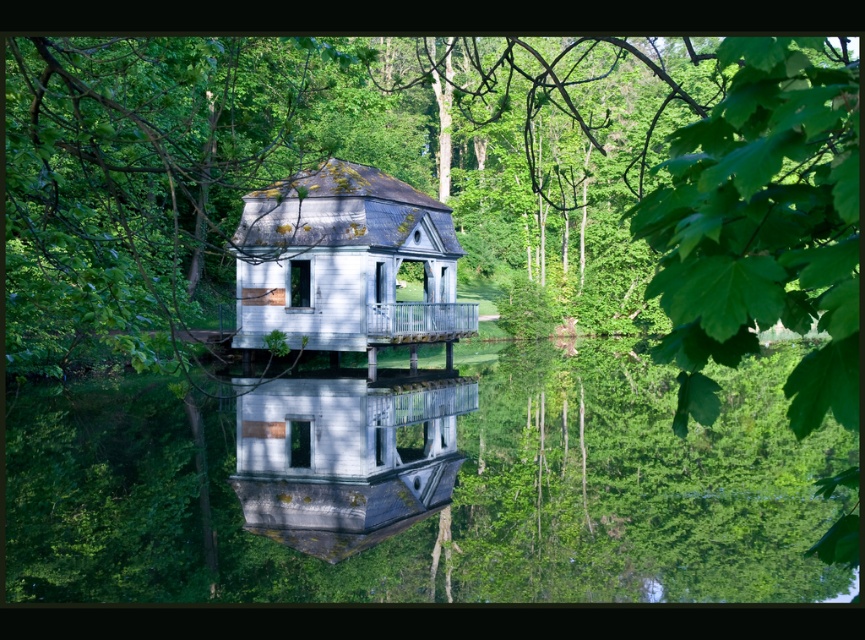
You are a photographer planning to capture the white matte house at center and the transparent water at center in a single shot. Based on their positions, which object should you frame first to ensure both are included in the photo?

The transparent water at center is positioned on the right side of white matte house at center, so you should frame the white matte house at center first to ensure both are included in the photo.

Based on the photo, you are a photographer trying to capture the white matte house at center in the image. However, the transparent water at center is obstructing your view. Can you determine which object is larger in size to decide if the house is fully visible?

The transparent water at center is larger in size than the white matte house at center, so the house might be partially obscured by the water in your photo.